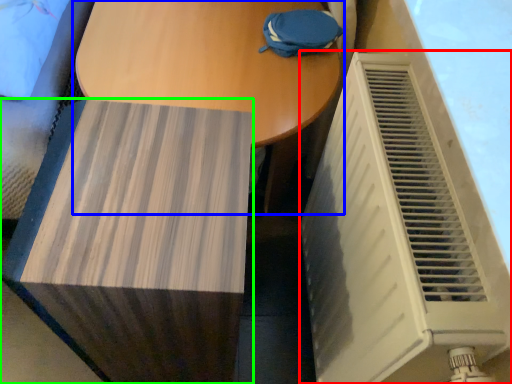
Question: Considering the real-world distances, which object is closest to air conditioning (highlighted by a red box)? table (highlighted by a blue box) or furniture (highlighted by a green box).

Choices:
 (A) table
 (B) furniture

Answer: (B)